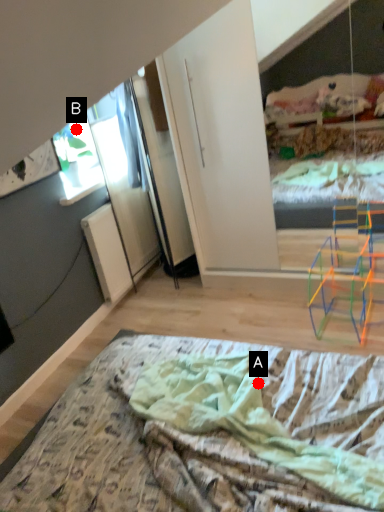
Question: Two points are circled on the image, labeled by A and B beside each circle. Which point appears farthest from the camera in this image?

Choices:
 (A) A is further
 (B) B is further

Answer: (B)